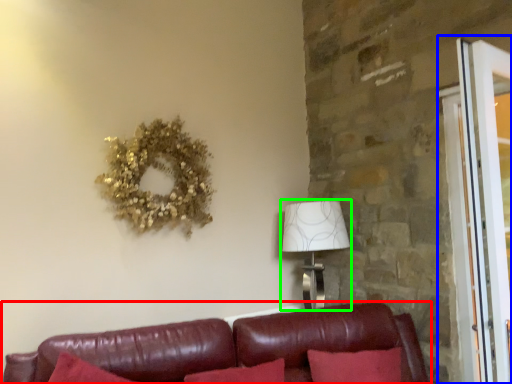
Question: Which is farther away from studio couch (highlighted by a red box)? screen door (highlighted by a blue box) or table lamp (highlighted by a green box)?

Choices:
 (A) screen door
 (B) table lamp

Answer: (A)